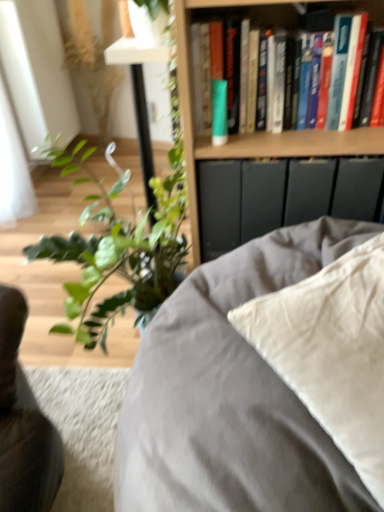
Question: In terms of size, does hardcover books at upper right appear bigger or smaller than wooden bookshelf at upper center?

Choices:
 (A) small
 (B) big

Answer: (A)

Question: In terms of height, does hardcover books at upper right look taller or shorter compared to wooden bookshelf at upper center?

Choices:
 (A) tall
 (B) short

Answer: (B)

Question: Which of these objects is positioned farthest from the green matte tube at upper center?

Choices:
 (A) satin beige pillow at center
 (B) wooden bookshelf at upper center
 (C) hardcover books at upper right

Answer: (A)

Question: Estimate the real-world distances between objects in this image. Which object is closer to the green matte tube at upper center?

Choices:
 (A) satin beige pillow at center
 (B) hardcover books at upper right
 (C) wooden bookshelf at upper center

Answer: (C)